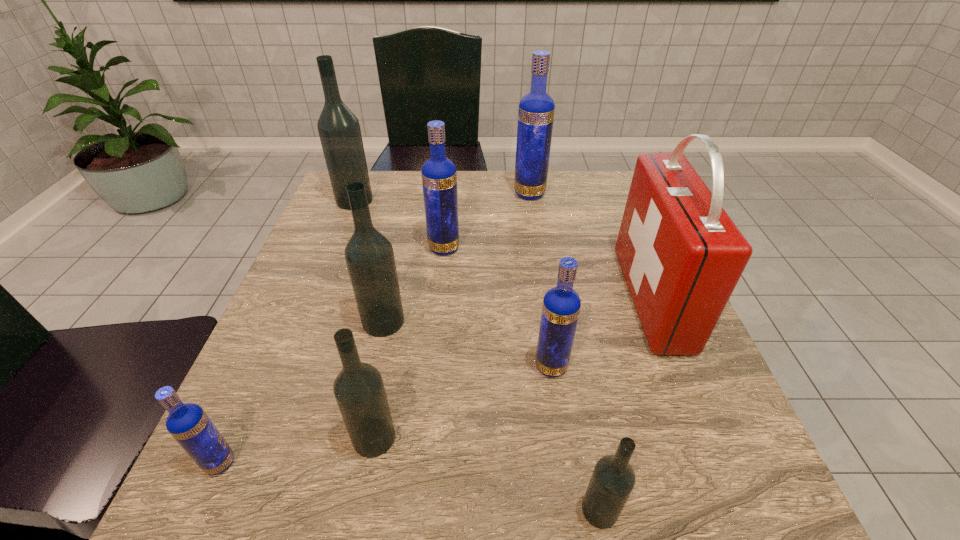
You are a GUI agent. You are given a task and a screenshot of the screen. Output one action in this format:
    pyautogui.click(x=<x>, y=<y>)
    Task: Click on the fourth nearest vodka
    This screenshot has width=960, height=540.
    Given the screenshot: What is the action you would take?
    pyautogui.click(x=561, y=305)

In order to click on the second smallest black vodka in this screenshot , I will do `click(359, 390)`.

Identify the location of the smallest blue vodka. The width and height of the screenshot is (960, 540). (190, 426).

Where is `the leftmost blue vodka`? the leftmost blue vodka is located at coordinates (190, 426).

This screenshot has height=540, width=960. Identify the location of the nearest object. (613, 479).

Image resolution: width=960 pixels, height=540 pixels. What are the coordinates of `the rightmost black vodka` in the screenshot? It's located at (613, 479).

This screenshot has width=960, height=540. I want to click on vacant area situated on the right of the biggest blue vodka, so click(x=564, y=194).

In order to click on vacant area situated 0.230m on the right of the farthest black vodka in this screenshot , I will do `click(459, 200)`.

At what (x,y) coordinates should I click in order to perform the action: click on free spot located on the front face of the rightmost object. Please return your answer as a coordinate pair (x, y). The height and width of the screenshot is (540, 960). Looking at the image, I should click on (458, 299).

Identify the location of free space located 0.060m on the front face of the rightmost object. The image size is (960, 540). (600, 299).